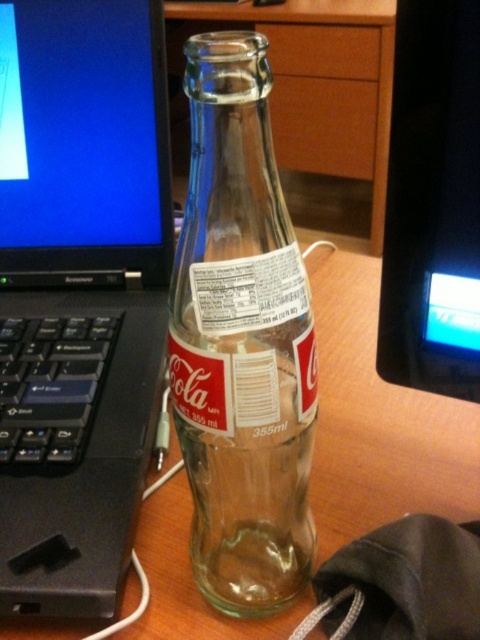
You are organizing items on a desk and need to move the clear glass bottle at center and the black glossy monitor at upper right. Based on their positions, which object is closer to you?

The clear glass bottle at center is closer to you because it is in front of the black glossy monitor at upper right.

You are organizing items on a desk and want to place a new item between the black plastic laptop at left and the clear glass bottle at center. Is there enough space between them to fit a 10cm wide item?

The black plastic laptop at left is to the left of clear glass bottle at center, so there is space between them. Since the question doesn not provide specific measurements of the distance between the two objects, I cannot confirm if the 10cm wide item would fit. Please check the actual distance between the black plastic laptop at left and clear glass bottle at center.